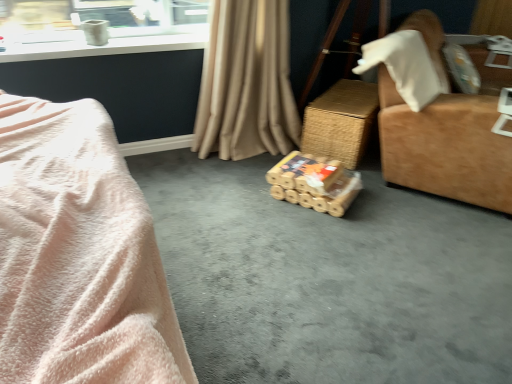
Question: Does bamboo-textured toy at center appear on the right side of beige fabric curtain at center?

Choices:
 (A) no
 (B) yes

Answer: (B)

Question: From a real-world perspective, is bamboo-textured toy at center located higher than beige fabric curtain at center?

Choices:
 (A) yes
 (B) no

Answer: (B)

Question: Is bamboo-textured toy at center wider than beige fabric curtain at center?

Choices:
 (A) yes
 (B) no

Answer: (A)

Question: Can you confirm if bamboo-textured toy at center is taller than beige fabric curtain at center?

Choices:
 (A) yes
 (B) no

Answer: (B)

Question: Considering the relative sizes of bamboo-textured toy at center and beige fabric curtain at center in the image provided, is bamboo-textured toy at center bigger than beige fabric curtain at center?

Choices:
 (A) yes
 (B) no

Answer: (B)

Question: Is bamboo-textured toy at center not inside beige fabric curtain at center?

Choices:
 (A) yes
 (B) no

Answer: (A)

Question: Considering the relative sizes of soft pink plush at left and suede-like brown armchair at right in the image provided, is soft pink plush at left shorter than suede-like brown armchair at right?

Choices:
 (A) yes
 (B) no

Answer: (A)

Question: Is soft pink plush at left at the left side of suede-like brown armchair at right?

Choices:
 (A) yes
 (B) no

Answer: (A)

Question: From a real-world perspective, is soft pink plush at left over suede-like brown armchair at right?

Choices:
 (A) no
 (B) yes

Answer: (B)

Question: From the image's perspective, is soft pink plush at left beneath suede-like brown armchair at right?

Choices:
 (A) yes
 (B) no

Answer: (A)

Question: Does soft pink plush at left have a greater height compared to suede-like brown armchair at right?

Choices:
 (A) no
 (B) yes

Answer: (A)

Question: Would you say soft pink plush at left is outside suede-like brown armchair at right?

Choices:
 (A) yes
 (B) no

Answer: (A)

Question: Is suede-like brown armchair at right beside bamboo-textured toy at center?

Choices:
 (A) no
 (B) yes

Answer: (A)